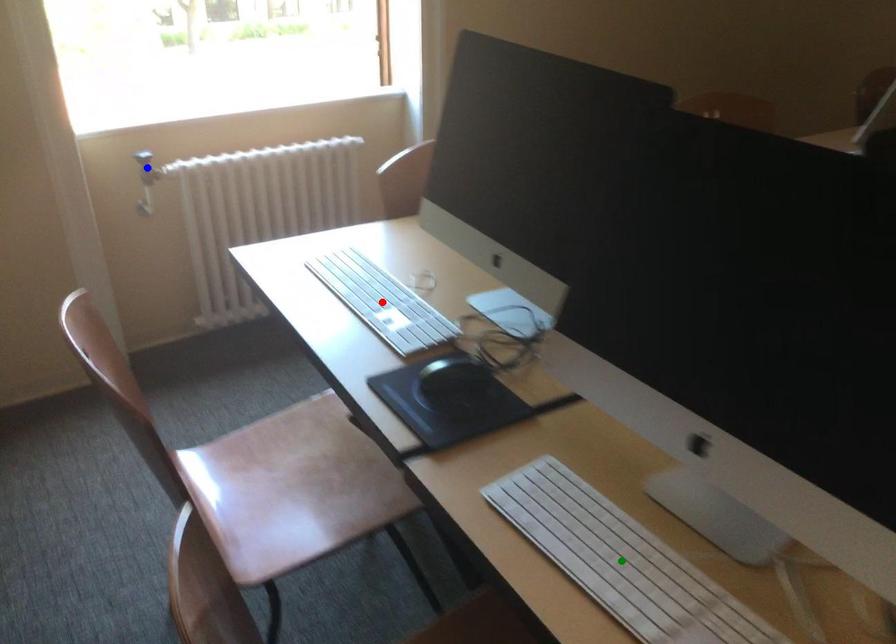
Order these from nearest to farthest:
A) red point
B) green point
C) blue point

green point → red point → blue point